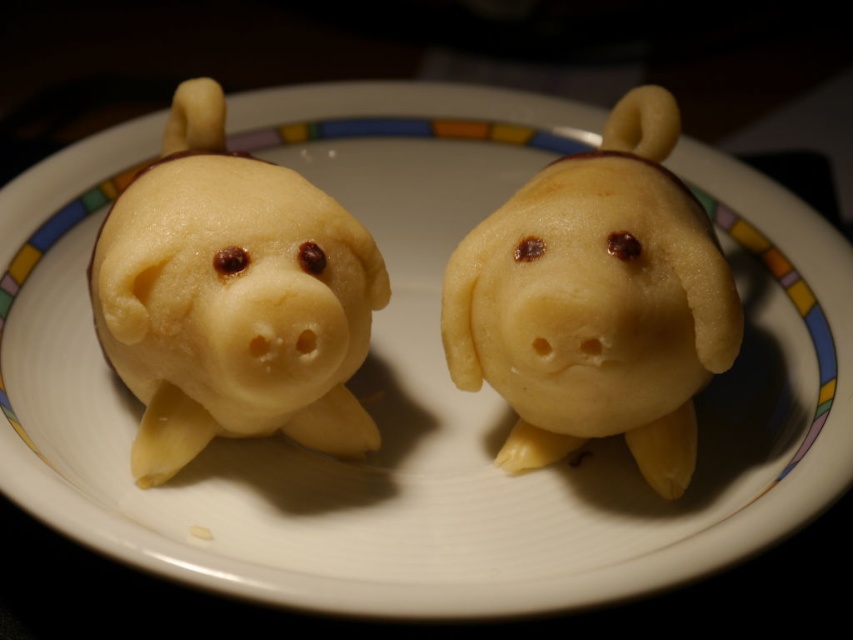
Can you confirm if matte yellow pastry at left is positioned to the left of yellow matte piglet at center?

Indeed, matte yellow pastry at left is positioned on the left side of yellow matte piglet at center.

Who is more forward, (351, 259) or (463, 250)?

Point (351, 259) is more forward.

Where is `matte yellow pastry at left`? matte yellow pastry at left is located at coordinates (231, 298).